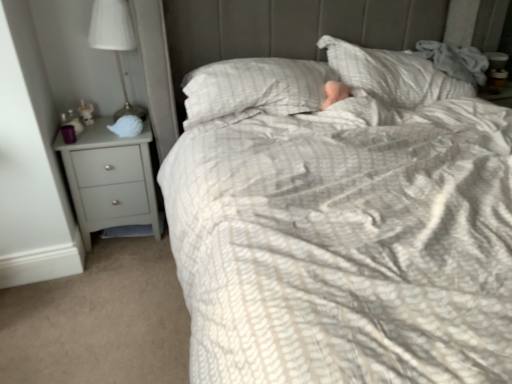
Question: Does matte gray chest of drawers at left have a larger size compared to white matte shell at left?

Choices:
 (A) no
 (B) yes

Answer: (B)

Question: Considering the relative sizes of matte gray chest of drawers at left and white matte shell at left in the image provided, is matte gray chest of drawers at left shorter than white matte shell at left?

Choices:
 (A) yes
 (B) no

Answer: (B)

Question: From a real-world perspective, does matte gray chest of drawers at left sit lower than white matte shell at left?

Choices:
 (A) yes
 (B) no

Answer: (A)

Question: From the image's perspective, is matte gray chest of drawers at left over white matte shell at left?

Choices:
 (A) no
 (B) yes

Answer: (A)

Question: Is white matte shell at left a part of matte gray chest of drawers at left?

Choices:
 (A) yes
 (B) no

Answer: (B)

Question: Is matte gray chest of drawers at left positioned behind white matte shell at left?

Choices:
 (A) yes
 (B) no

Answer: (B)

Question: Can you confirm if matte gray chest of drawers at left is shorter than white fabric lampshade at left?

Choices:
 (A) yes
 (B) no

Answer: (B)

Question: Is matte gray chest of drawers at left outside of white fabric lampshade at left?

Choices:
 (A) no
 (B) yes

Answer: (B)

Question: Is matte gray chest of drawers at left to the right of white fabric lampshade at left from the viewer's perspective?

Choices:
 (A) yes
 (B) no

Answer: (B)

Question: Is matte gray chest of drawers at left oriented away from white fabric lampshade at left?

Choices:
 (A) yes
 (B) no

Answer: (B)

Question: Does matte gray chest of drawers at left have a larger size compared to white fabric lampshade at left?

Choices:
 (A) no
 (B) yes

Answer: (B)

Question: From the image's perspective, is matte gray chest of drawers at left under white fabric lampshade at left?

Choices:
 (A) yes
 (B) no

Answer: (A)

Question: Considering the relative sizes of white matte shell at left and matte gray chest of drawers at left in the image provided, is white matte shell at left taller than matte gray chest of drawers at left?

Choices:
 (A) yes
 (B) no

Answer: (B)